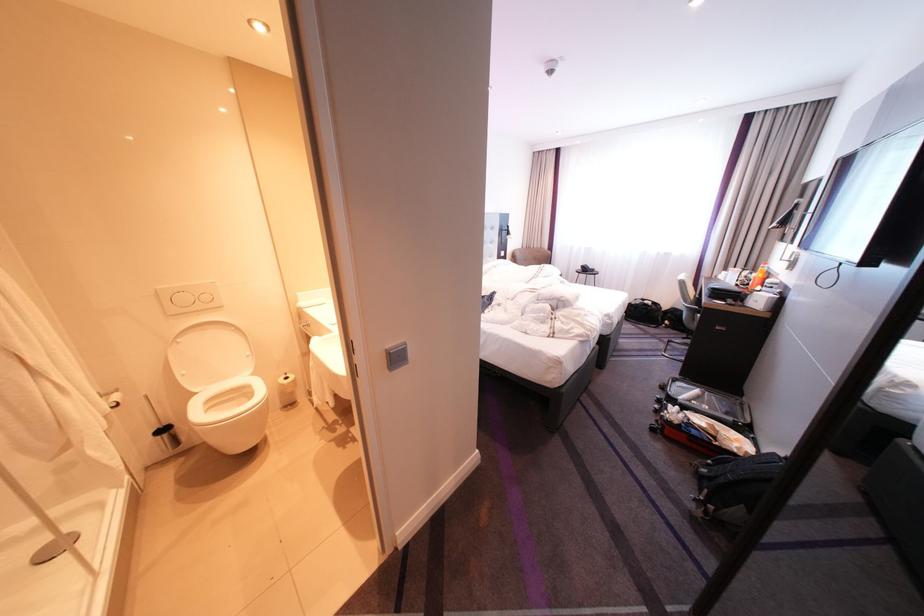
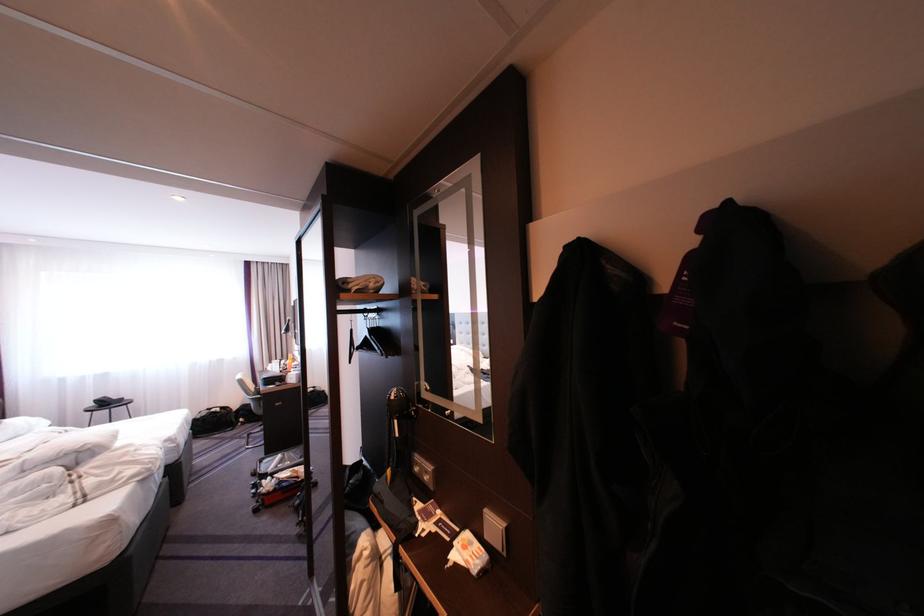
Where in the second image is the point corresponding to (697,302) from the first image?

(261, 395)